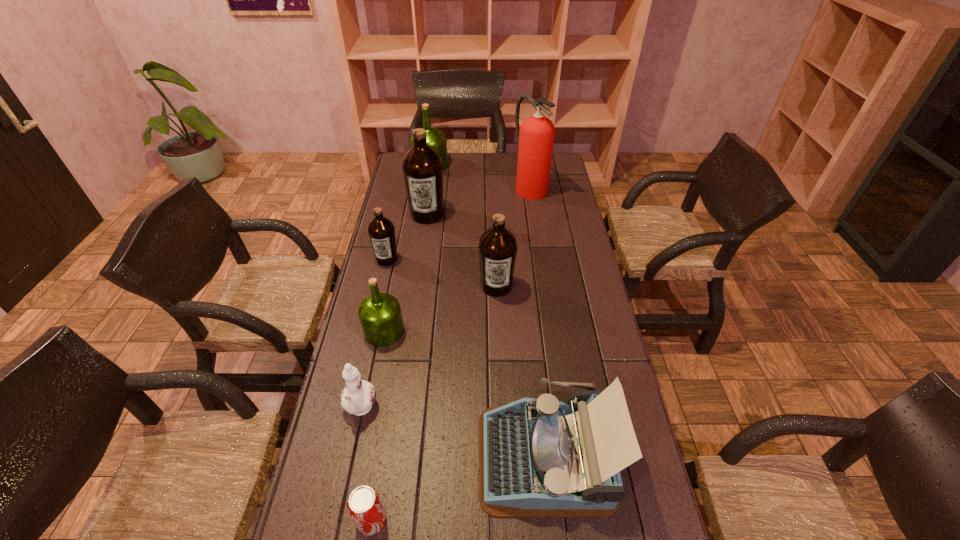
Image resolution: width=960 pixels, height=540 pixels. Identify the location of fire extinguisher. (535, 137).

The height and width of the screenshot is (540, 960). In order to click on the farthest brown olive oil in this screenshot , I will do `click(422, 167)`.

Identify the location of the fourth nearest olive oil. The width and height of the screenshot is (960, 540). (422, 167).

Locate an element on the screen. The width and height of the screenshot is (960, 540). the farthest olive oil is located at coordinates (436, 139).

The width and height of the screenshot is (960, 540). I want to click on the farther green olive oil, so pos(436,139).

I want to click on the nearest brown olive oil, so click(x=497, y=246).

The height and width of the screenshot is (540, 960). Identify the location of the rightmost brown olive oil. (497, 246).

Where is `the second farthest brown olive oil`? This screenshot has width=960, height=540. the second farthest brown olive oil is located at coordinates (381, 231).

Where is `the leftmost brown olive oil`? the leftmost brown olive oil is located at coordinates (381, 231).

This screenshot has width=960, height=540. Find the location of `the nearer green olive oil`. the nearer green olive oil is located at coordinates (380, 316).